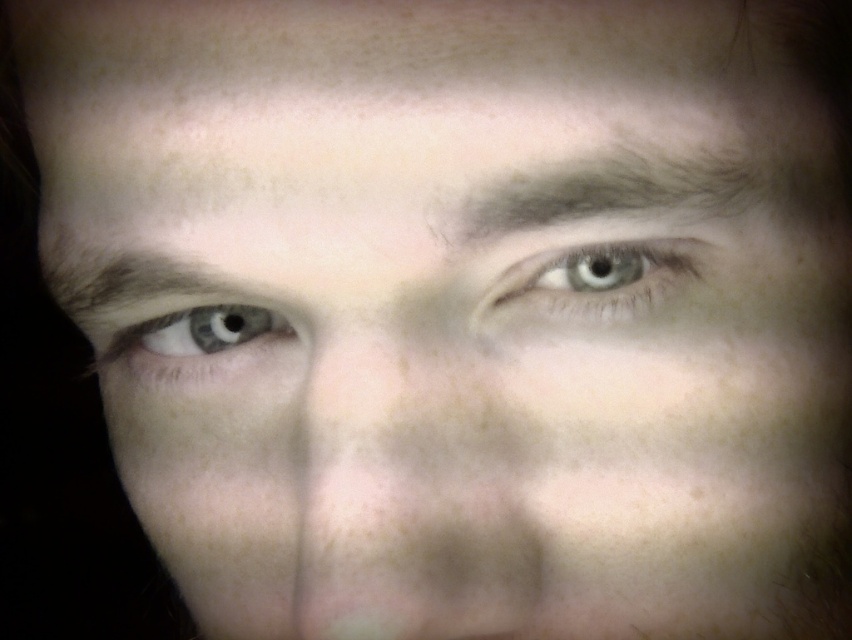
Question: Estimate the real-world distances between objects in this image. Which object is farther from the blue glossy eye at left?

Choices:
 (A) smooth skin nose at center
 (B) brown matte eyebrow at upper left
 (C) blue matte eye at upper center

Answer: (C)

Question: Based on their relative distances, which object is farther from the smooth skin nose at center?

Choices:
 (A) dark brown hair at upper center
 (B) brown matte eyebrow at upper left
 (C) blue matte eye at upper center
 (D) blue glossy eye at left

Answer: (B)

Question: Is blue matte eye at upper center thinner than brown matte eyebrow at upper left?

Choices:
 (A) yes
 (B) no

Answer: (A)

Question: Does smooth skin nose at center come behind dark brown hair at upper center?

Choices:
 (A) yes
 (B) no

Answer: (B)

Question: Is smooth skin nose at center to the left of blue glossy eye at left from the viewer's perspective?

Choices:
 (A) yes
 (B) no

Answer: (B)

Question: Which point is closer to the camera taking this photo?

Choices:
 (A) (616, 172)
 (B) (550, 291)

Answer: (A)